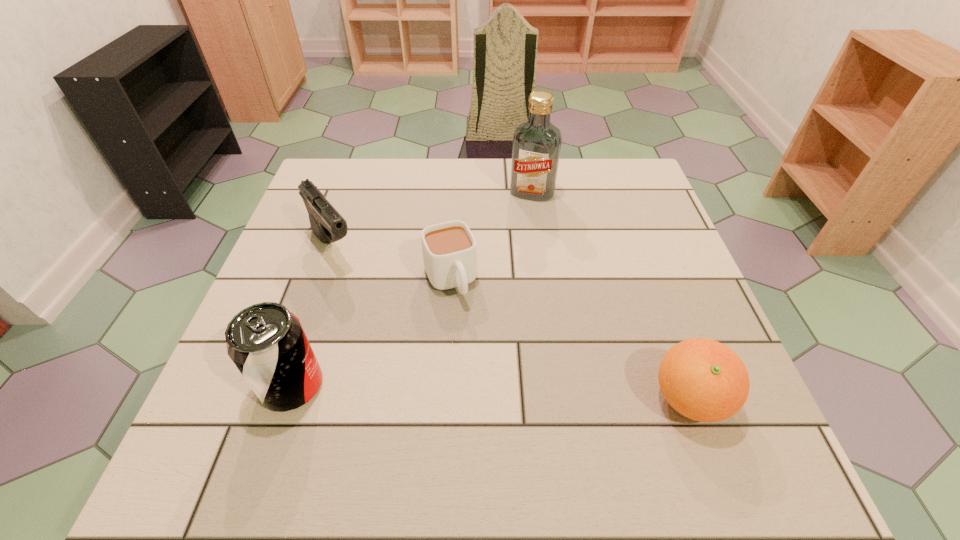
The image size is (960, 540). Identify the location of free space located 0.140m at the barrel of the pistol. (374, 306).

The width and height of the screenshot is (960, 540). Find the location of `free space located 0.100m at the barrel of the pistol`. free space located 0.100m at the barrel of the pistol is located at coordinates (366, 294).

This screenshot has width=960, height=540. I want to click on vacant space situated 0.300m at the barrel of the pistol, so click(414, 356).

Where is `blank space located 0.120m on the side with the handle of the shortest object`? The height and width of the screenshot is (540, 960). blank space located 0.120m on the side with the handle of the shortest object is located at coordinates (478, 351).

Find the location of `vacant region located on the side with the handle of the shortest object`. vacant region located on the side with the handle of the shortest object is located at coordinates (496, 395).

Find the location of a particular element. This screenshot has height=540, width=960. vacant space situated on the side with the handle of the shortest object is located at coordinates (496, 395).

This screenshot has width=960, height=540. Find the location of `vacant region located on the front-facing side of the farthest object`. vacant region located on the front-facing side of the farthest object is located at coordinates (514, 237).

Image resolution: width=960 pixels, height=540 pixels. I want to click on vacant region located 0.080m on the front-facing side of the farthest object, so click(520, 220).

Locate an element on the screen. This screenshot has width=960, height=540. vacant space located 0.070m on the front-facing side of the farthest object is located at coordinates (521, 218).

Identify the location of object located at the far edge. This screenshot has height=540, width=960. (536, 147).